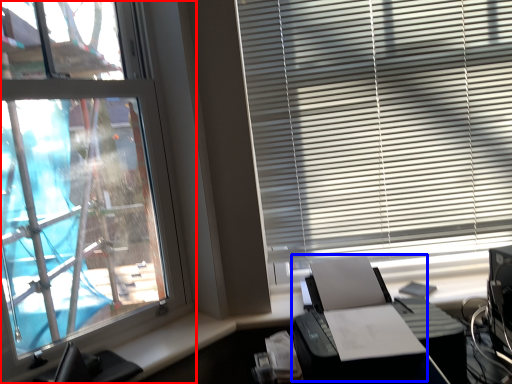
Question: Among these objects, which one is nearest to the camera, window (highlighted by a red box) or printer (highlighted by a blue box)?

Choices:
 (A) window
 (B) printer

Answer: (A)